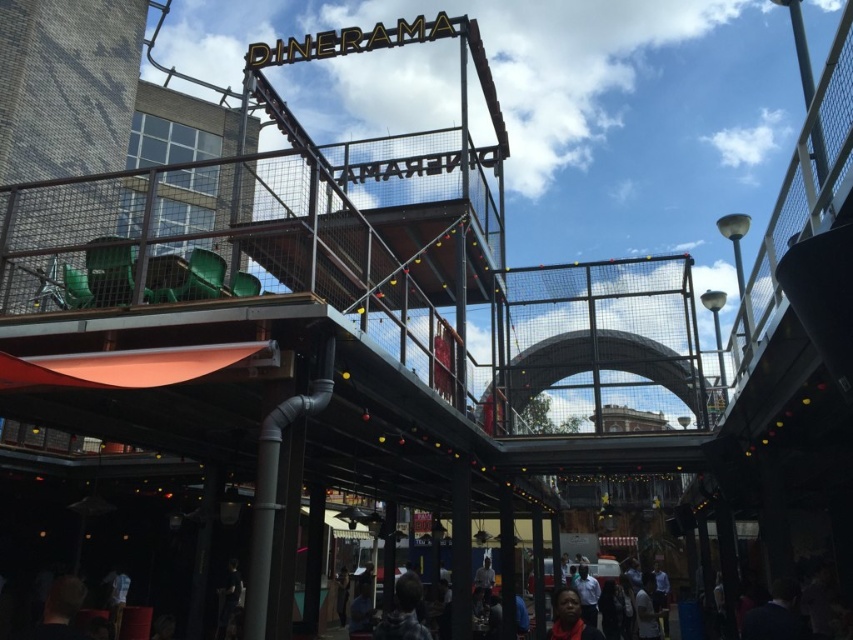
You are a photographer standing at the entrance of the DINERAMA structure. You notice two subjects in the lower center area of your viewfinder, the dark gray hoodie at lower center and the smooth skin face at lower center. Which subject should you focus on if you want to capture the one that is taller?

The smooth skin face at lower center is taller than the dark gray hoodie at lower center, so you should focus on the smooth skin face at lower center to capture the taller subject.